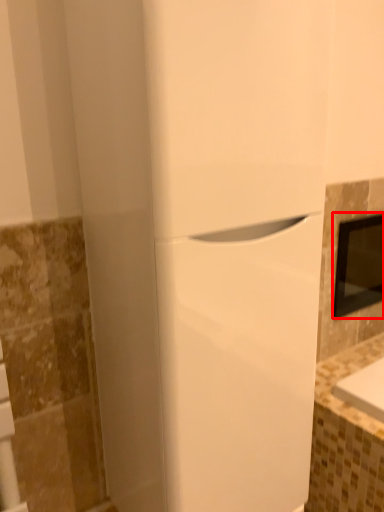
Question: Where is medicine cabinet (annotated by the red box) located in relation to home appliance in the image?

Choices:
 (A) left
 (B) right

Answer: (B)